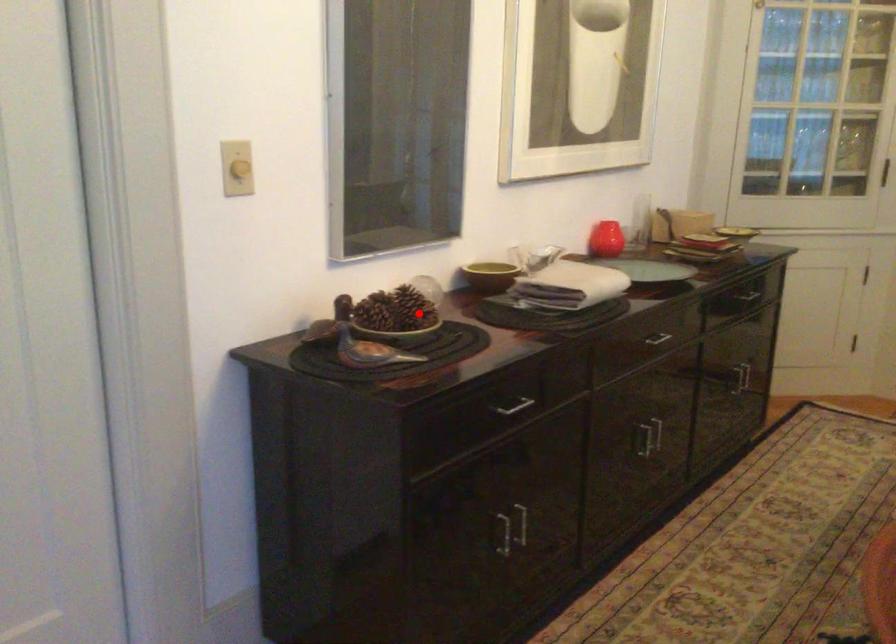
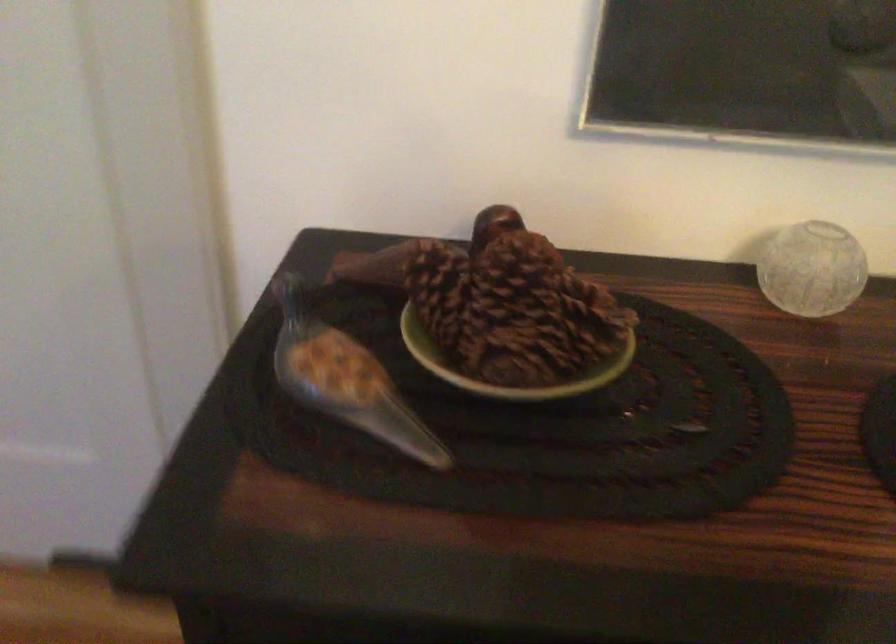
Question: I am providing you with two images of the same scene from different viewpoints. Given a red point in image1, look at the same physical point in image2. Is it:

Choices:
 (A) Closer to the viewpoint
 (B) Farther from the viewpoint

Answer: (A)